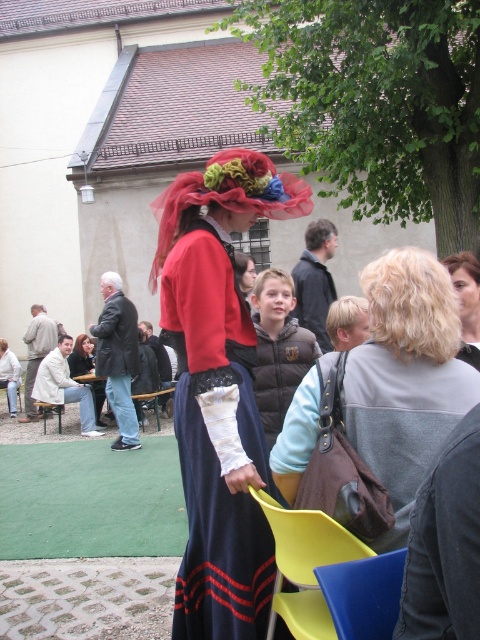
Who is positioned more to the left, light beige fabric jacket at lower left or matte black dress at center?

light beige fabric jacket at lower left is more to the left.

Does point (37, 378) lie behind point (82, 369)?

No, it is in front of (82, 369).

The width and height of the screenshot is (480, 640). What do you see at coordinates (64, 385) in the screenshot?
I see `light beige fabric jacket at lower left` at bounding box center [64, 385].

You are a GUI agent. You are given a task and a screenshot of the screen. Output one action in this format:
    pyautogui.click(x=<x>, y=<y>)
    Task: Click on the light beige fabric jacket at lower left
    This screenshot has height=640, width=480.
    Given the screenshot: What is the action you would take?
    pyautogui.click(x=64, y=385)

The height and width of the screenshot is (640, 480). What do you see at coordinates (406, 378) in the screenshot? I see `matte brown purse at center` at bounding box center [406, 378].

Can you confirm if matte brown purse at center is wider than blonde hair at upper right?

Correct, the width of matte brown purse at center exceeds that of blonde hair at upper right.

This screenshot has width=480, height=640. I want to click on matte brown purse at center, so click(x=406, y=378).

Image resolution: width=480 pixels, height=640 pixels. I want to click on matte brown purse at center, so click(406, 378).

Does dark gray leather jacket at left have a greater width compared to blonde hair at upper right?

Yes.

Does dark gray leather jacket at left lie behind blonde hair at upper right?

That is True.

Which is behind, point (105, 314) or point (479, 324)?

The point (105, 314) is behind.

I want to click on dark gray leather jacket at left, so tap(118, 356).